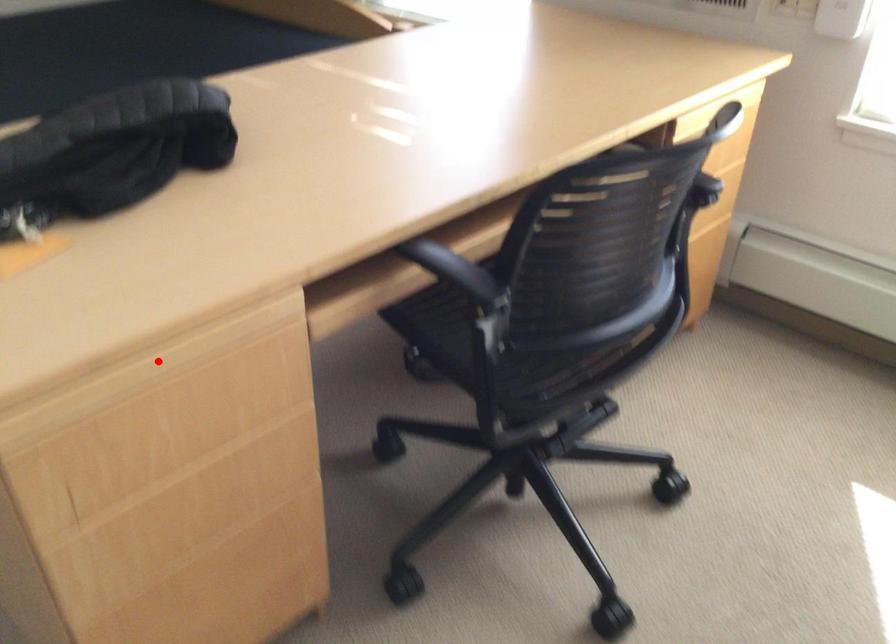
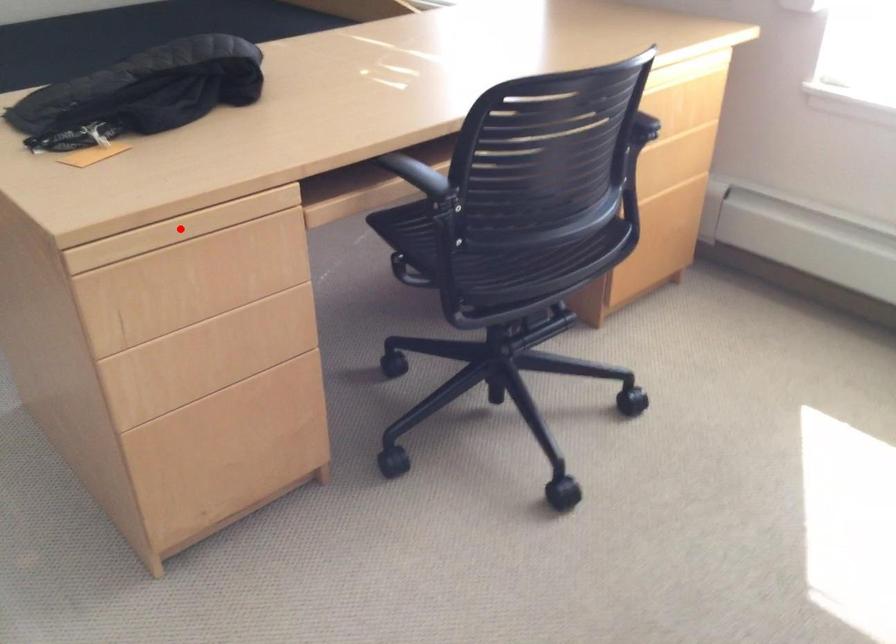
Consider the image. I am providing you with two images of the same scene from different viewpoints. A red point is marked on the first image and another point is marked on the second image. Are the points marked in image1 and image2 representing the same 3D position?

Yes